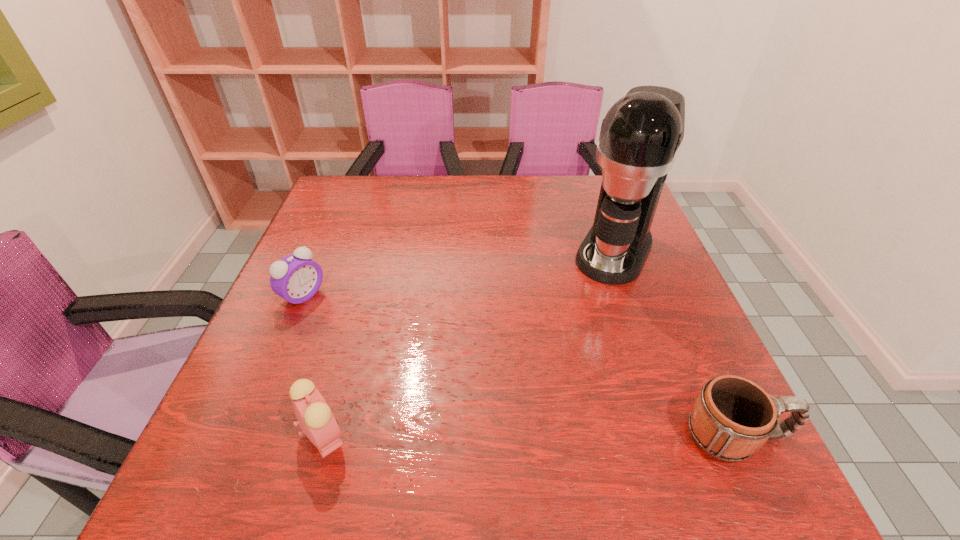
Identify the location of the third object from right to left. This screenshot has height=540, width=960. (316, 420).

The height and width of the screenshot is (540, 960). I want to click on the right alarm clock, so click(x=316, y=420).

At what (x,y) coordinates should I click in order to perform the action: click on mug. Please return your answer as a coordinate pair (x, y). This screenshot has width=960, height=540. Looking at the image, I should click on (732, 417).

You are a GUI agent. You are given a task and a screenshot of the screen. Output one action in this format:
    pyautogui.click(x=<x>, y=<y>)
    Task: Click on the coffee maker
    
    Given the screenshot: What is the action you would take?
    pyautogui.click(x=641, y=135)

Image resolution: width=960 pixels, height=540 pixels. Find the location of `the left alarm clock`. the left alarm clock is located at coordinates (296, 278).

In order to click on the farther alarm clock in this screenshot , I will do `click(296, 278)`.

The image size is (960, 540). I want to click on vacant space situated on the face of the nearer alarm clock, so click(x=524, y=435).

Identify the location of vacant space positioned place cup under the spout of the tallest object. This screenshot has height=540, width=960. (546, 391).

The width and height of the screenshot is (960, 540). Find the location of `free space located 0.240m place cup under the spout of the tallest object`. free space located 0.240m place cup under the spout of the tallest object is located at coordinates (567, 350).

This screenshot has width=960, height=540. Identify the location of vacant space located place cup under the spout of the tallest object. (579, 327).